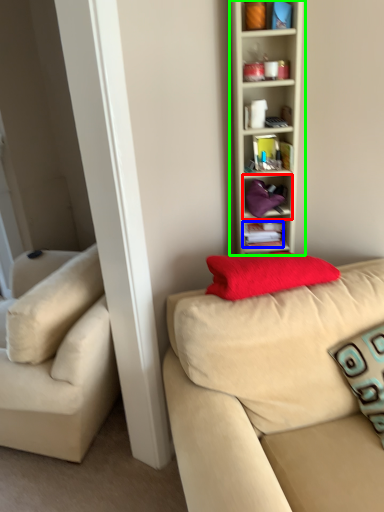
Question: Which is nearer to the cabinet (highlighted by a red box)? book (highlighted by a blue box) or shelf (highlighted by a green box).

Choices:
 (A) book
 (B) shelf

Answer: (A)